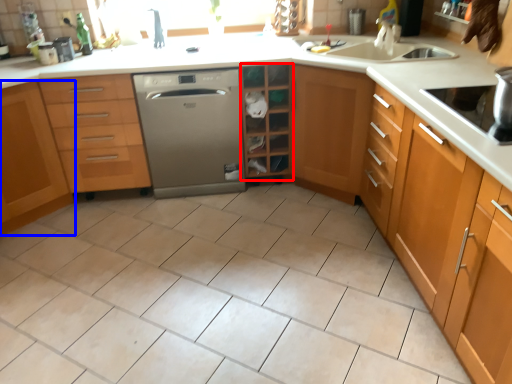
Question: Among these objects, which one is farthest to the camera, shelf (highlighted by a red box) or cabinetry (highlighted by a blue box)?

Choices:
 (A) shelf
 (B) cabinetry

Answer: (A)